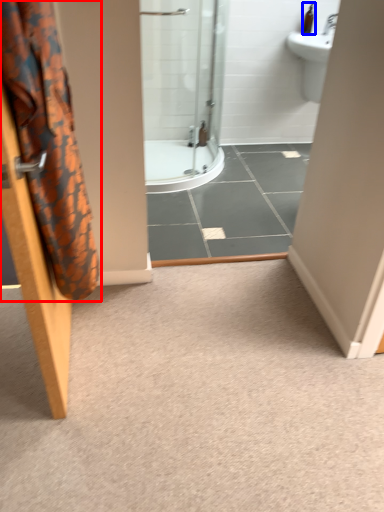
Question: Which object appears closest to the camera in this image, shower curtain (highlighted by a red box) or toiletry (highlighted by a blue box)?

Choices:
 (A) shower curtain
 (B) toiletry

Answer: (A)